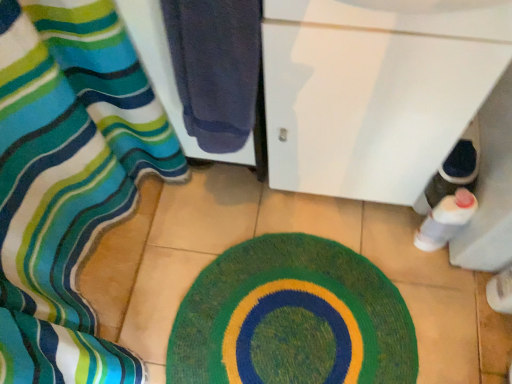
Find the location of a particular element. free area in between white glossy bottle at lower right and green knitted bath mat at center is located at coordinates (367, 254).